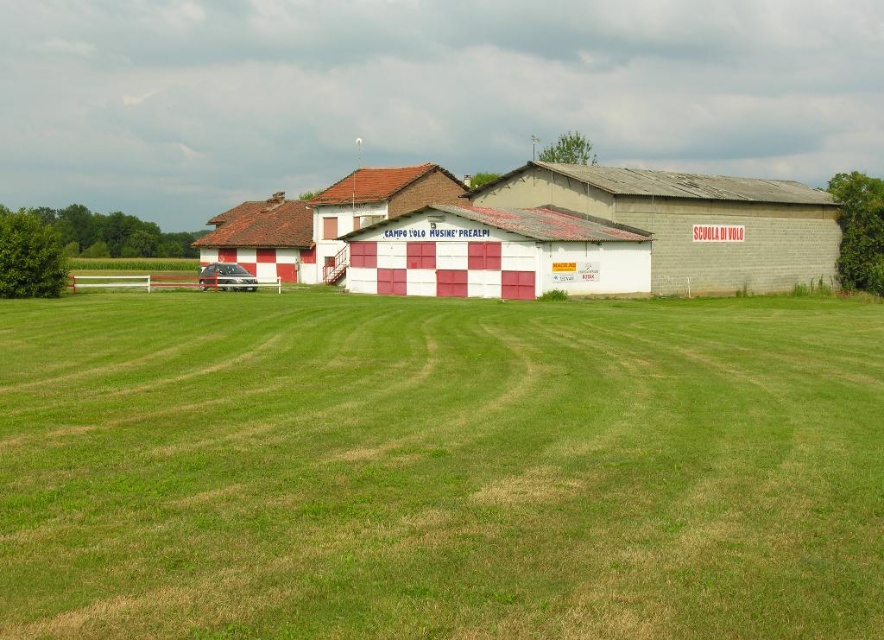
Question: Does green grass at center have a greater width compared to checkerboard painted barn at center?

Choices:
 (A) yes
 (B) no

Answer: (B)

Question: Which of the following is the farthest from the observer?

Choices:
 (A) (543, 349)
 (B) (317, 256)
 (C) (242, 285)

Answer: (B)

Question: Does green grass at center have a lesser width compared to metallic silver car at center?

Choices:
 (A) yes
 (B) no

Answer: (B)

Question: Which object is closer to the camera taking this photo?

Choices:
 (A) checkerboard painted barn at center
 (B) metallic silver car at center
 (C) green grass at center

Answer: (C)

Question: Among these points, which one is farthest from the camera?

Choices:
 (A) (227, 282)
 (B) (771, 208)

Answer: (B)

Question: Observing the image, what is the correct spatial positioning of checkerboard painted barn at center in reference to metallic silver car at center?

Choices:
 (A) above
 (B) below

Answer: (A)